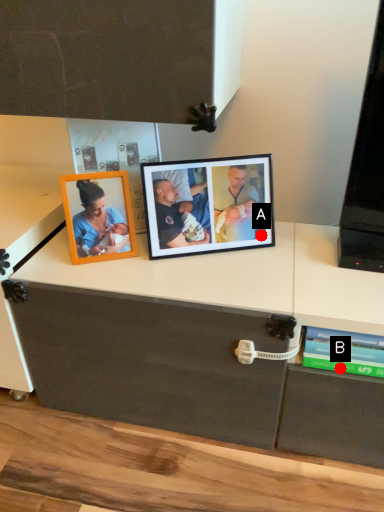
Question: Two points are circled on the image, labeled by A and B beside each circle. Which point appears closest to the camera in this image?

Choices:
 (A) A is closer
 (B) B is closer

Answer: (B)